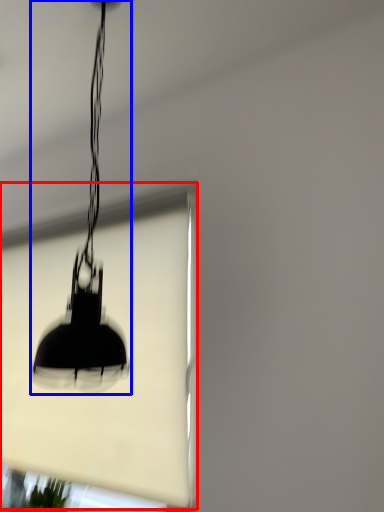
Question: Among these objects, which one is farthest to the camera, window screen (highlighted by a red box) or lamp (highlighted by a blue box)?

Choices:
 (A) window screen
 (B) lamp

Answer: (A)